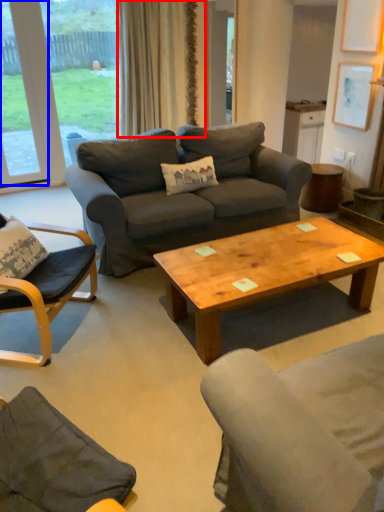
Question: Among these objects, which one is farthest to the camera, curtain (highlighted by a red box) or window (highlighted by a blue box)?

Choices:
 (A) curtain
 (B) window

Answer: (A)